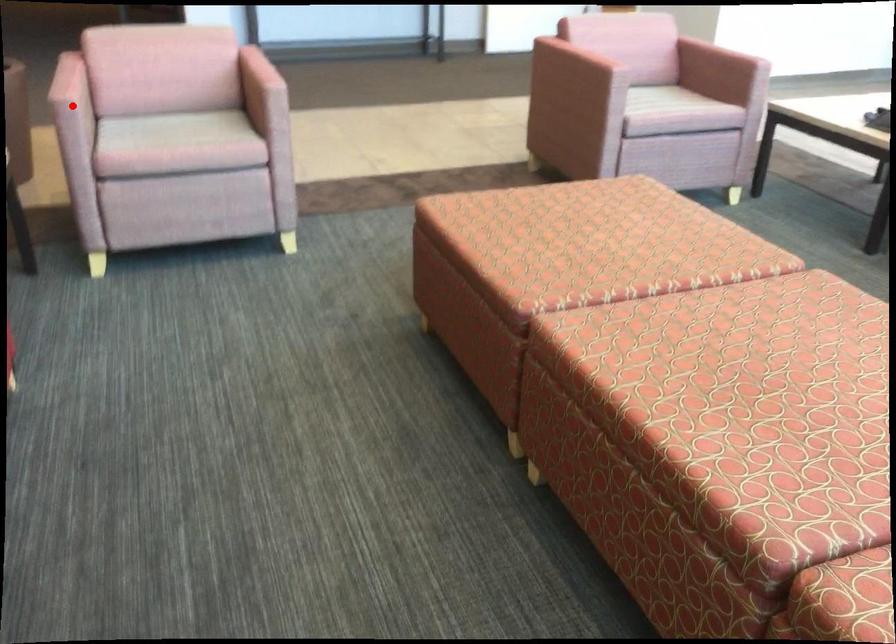
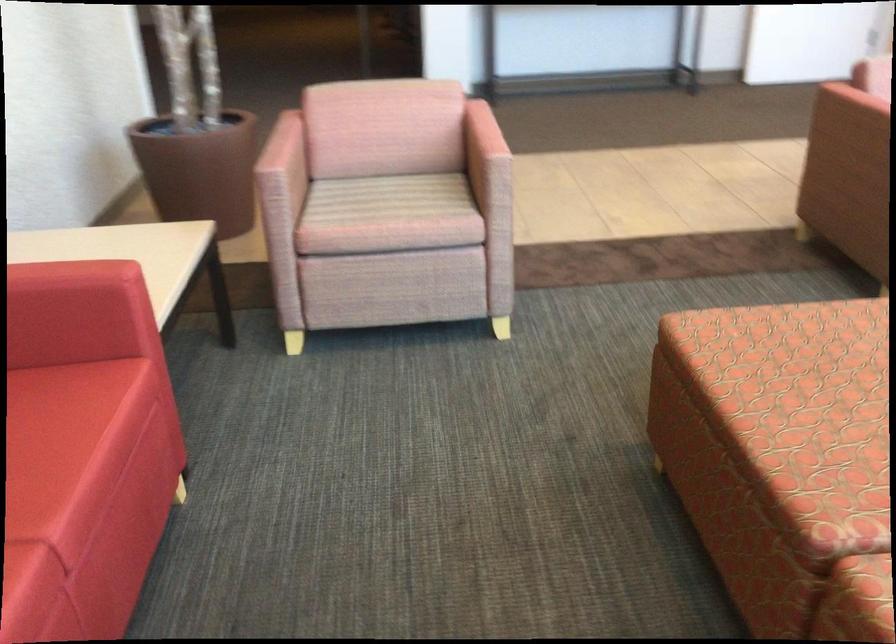
In the second image, find the point that corresponds to the highlighted location in the first image.

(280, 176)